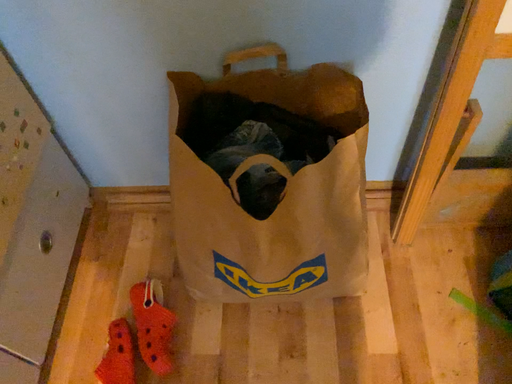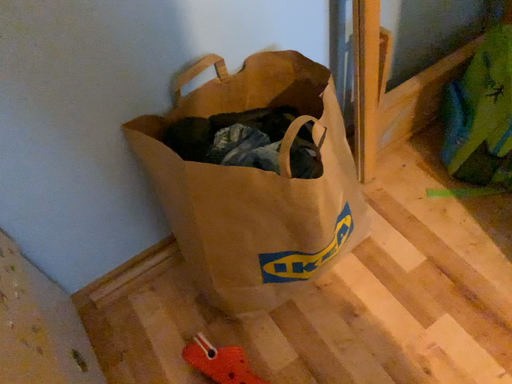
Question: Which way did the camera rotate in the video?

Choices:
 (A) rotated right
 (B) rotated left

Answer: (A)